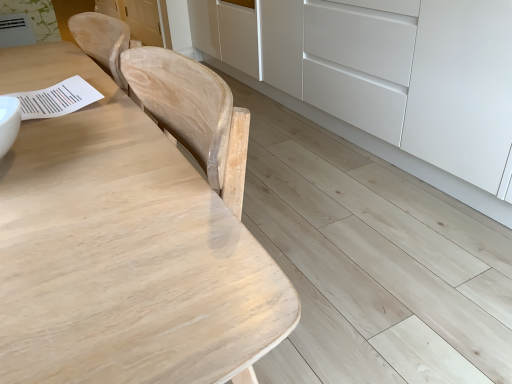
What do you see at coordinates (406, 80) in the screenshot?
I see `white matte cabinet at lower right` at bounding box center [406, 80].

Locate an element on the screen. This screenshot has width=512, height=384. white matte cabinet at lower right is located at coordinates (406, 80).

Identify the location of natural wood table at upper left. The width and height of the screenshot is (512, 384). click(x=122, y=249).

Describe the element at coordinates (122, 249) in the screenshot. I see `natural wood table at upper left` at that location.

You are a GUI agent. You are given a task and a screenshot of the screen. Output one action in this format:
    pyautogui.click(x=<x>, y=<y>)
    Task: Click on the white matte cabinet at lower right
    This screenshot has width=512, height=384.
    Given the screenshot: What is the action you would take?
    pyautogui.click(x=406, y=80)

Which object is positioned more to the right, white matte cabinet at lower right or natural wood table at upper left?

white matte cabinet at lower right.

Is the depth of white matte cabinet at lower right greater than that of natural wood table at upper left?

That is True.

Which is farther from the camera, (404, 128) or (284, 283)?

The point (404, 128) is farther from the camera.

From the image's perspective, which one is positioned lower, white matte cabinet at lower right or natural wood table at upper left?

natural wood table at upper left is shown below in the image.

From a real-world perspective, which object stands above the other?

From a 3D spatial view, natural wood table at upper left is above.

Can you confirm if white matte cabinet at lower right is wider than natural wood table at upper left?

Yes.

Which of these two, white matte cabinet at lower right or natural wood table at upper left, stands taller?

natural wood table at upper left.

Who is bigger, white matte cabinet at lower right or natural wood table at upper left?

white matte cabinet at lower right is bigger.

Can we say white matte cabinet at lower right lies outside natural wood table at upper left?

white matte cabinet at lower right lies outside natural wood table at upper left's area.

Based on the photo, would you consider white matte cabinet at lower right to be distant from natural wood table at upper left?

Absolutely, white matte cabinet at lower right is distant from natural wood table at upper left.

Is white matte cabinet at lower right turned away from natural wood table at upper left?

No, white matte cabinet at lower right is not facing the opposite direction of natural wood table at upper left.

What's the angular difference between white matte cabinet at lower right and natural wood table at upper left's facing directions?

The angle between the facing direction of white matte cabinet at lower right and the facing direction of natural wood table at upper left is 0.984 degrees.

Measure the distance from white matte cabinet at lower right to natural wood table at upper left.

They are 4.55 feet apart.

Identify the location of cabinetry lying above the natural wood table at upper left (from the image's perspective). (406, 80).

Between natural wood table at upper left and white matte cabinet at lower right, which one appears on the right side from the viewer's perspective?

From the viewer's perspective, white matte cabinet at lower right appears more on the right side.

Which object is more forward, natural wood table at upper left or white matte cabinet at lower right?

natural wood table at upper left is more forward.

Is point (16, 54) positioned in front of point (408, 138)?

Yes, it is in front of point (408, 138).

From the image's perspective, relative to white matte cabinet at lower right, is natural wood table at upper left above or below?

From the image's perspective, natural wood table at upper left appears below white matte cabinet at lower right.

From a real-world perspective, is natural wood table at upper left positioned above or below white matte cabinet at lower right?

In terms of real-world spatial position, natural wood table at upper left is above white matte cabinet at lower right.

Which of these two, natural wood table at upper left or white matte cabinet at lower right, is wider?

white matte cabinet at lower right is wider.

Can you confirm if natural wood table at upper left is taller than white matte cabinet at lower right?

Indeed, natural wood table at upper left has a greater height compared to white matte cabinet at lower right.

Considering the sizes of objects natural wood table at upper left and white matte cabinet at lower right in the image provided, who is smaller, natural wood table at upper left or white matte cabinet at lower right?

natural wood table at upper left.

Would you say white matte cabinet at lower right is part of natural wood table at upper left's contents?

Actually, white matte cabinet at lower right is outside natural wood table at upper left.

Is natural wood table at upper left next to white matte cabinet at lower right?

No, natural wood table at upper left is not beside white matte cabinet at lower right.

Looking at this image, is natural wood table at upper left facing towards white matte cabinet at lower right?

No, natural wood table at upper left is not aimed at white matte cabinet at lower right.

Can you tell me how much natural wood table at upper left and white matte cabinet at lower right differ in facing direction?

The facing directions of natural wood table at upper left and white matte cabinet at lower right are 0.984 degrees apart.

This screenshot has width=512, height=384. Identify the location of table in front of the white matte cabinet at lower right. (122, 249).

Locate an element on the screen. table below the white matte cabinet at lower right (from the image's perspective) is located at coordinates [x=122, y=249].

Where is `cabinetry that is under the natural wood table at upper left (from a real-world perspective)`? cabinetry that is under the natural wood table at upper left (from a real-world perspective) is located at coordinates click(406, 80).